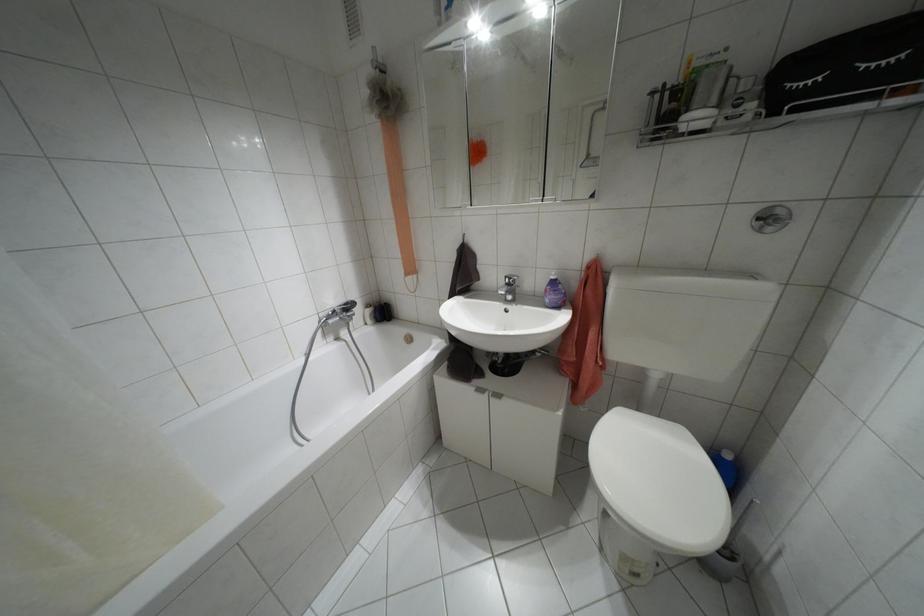
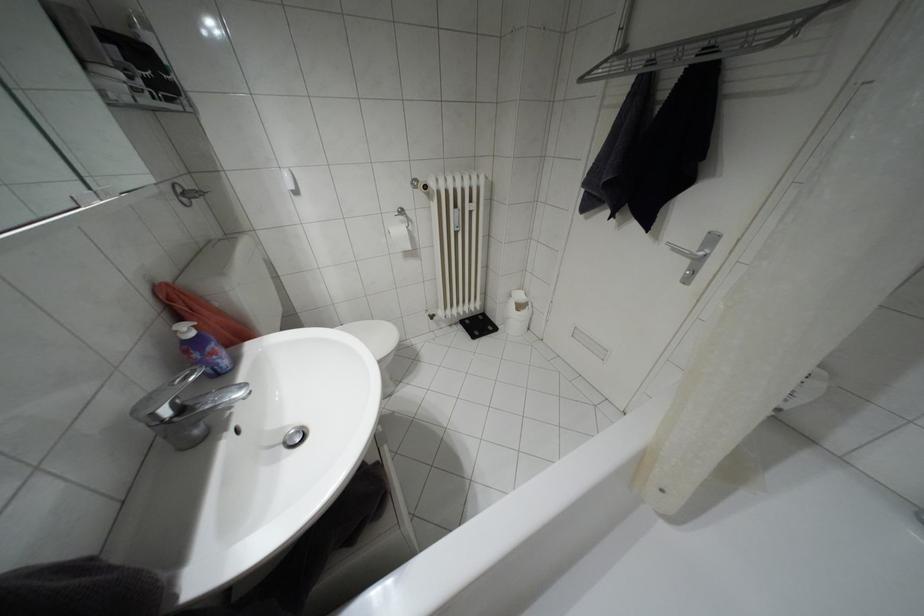
Locate, in the second image, the point that corresponds to [507,284] in the first image.

(180, 408)